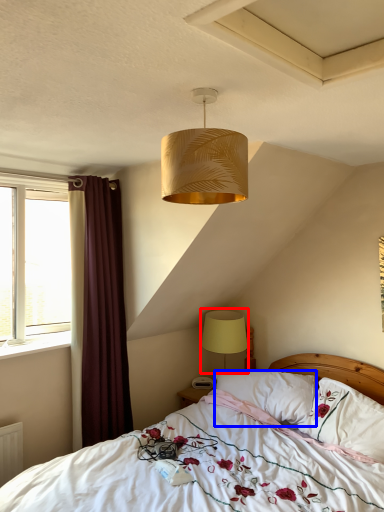
Question: Which object appears farthest to the camera in this image, lamp (highlighted by a red box) or pillow (highlighted by a blue box)?

Choices:
 (A) lamp
 (B) pillow

Answer: (A)